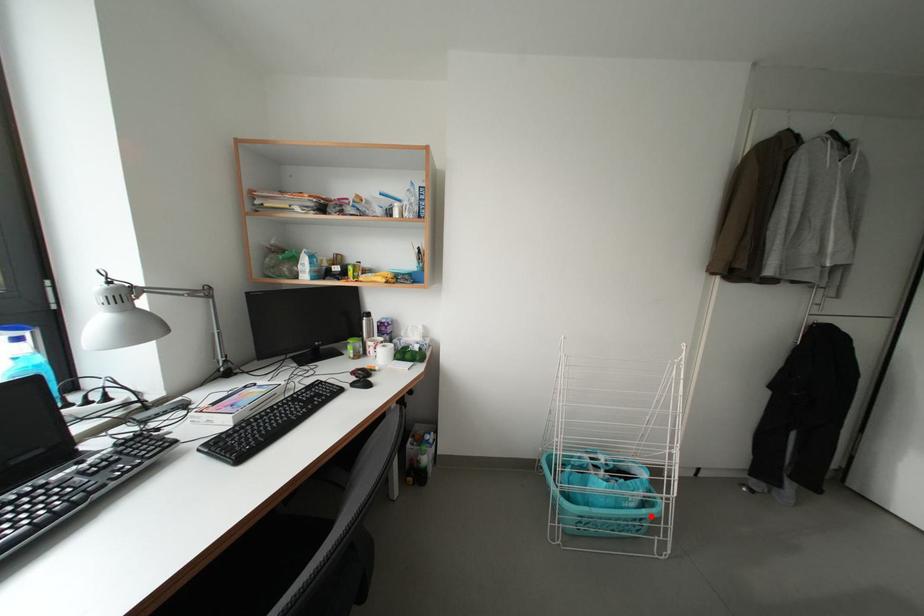
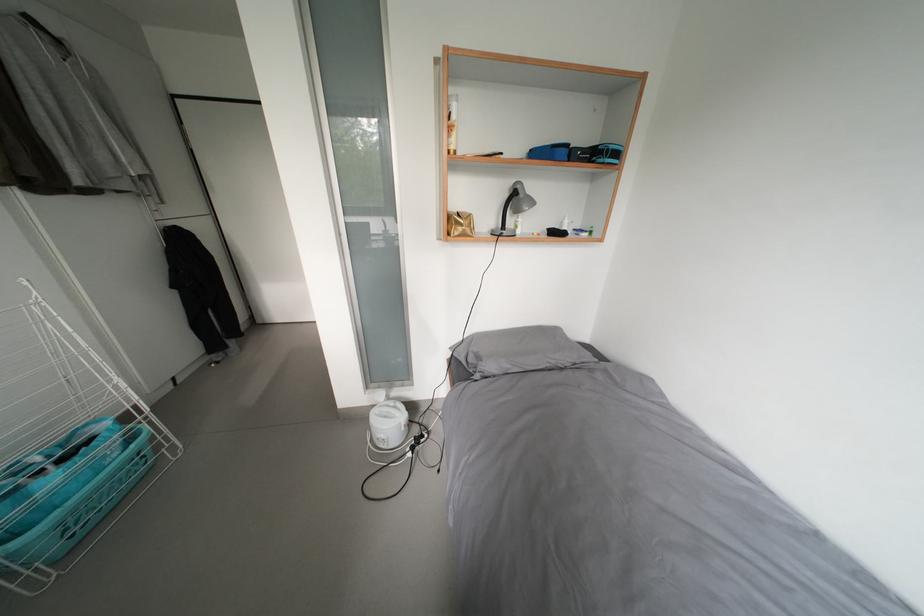
Where in the second image is the point corresponding to the highlighted location from the first image?

(140, 451)